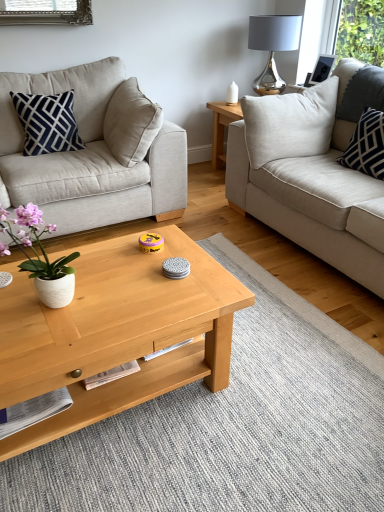
Find the location of a particular element. The height and width of the screenshot is (512, 384). light gray fabric couch at right, acting as the 1th studio couch starting from the right is located at coordinates (309, 177).

What is the approximate width of white ceramic pot at left?

It is 8.41 inches.

Describe the element at coordinates (367, 145) in the screenshot. I see `white textured pillow at right, which appears as the second pillow when viewed from the left` at that location.

Identify the location of light wood/texture coffee table at center. (116, 332).

What do you see at coordinates (116, 332) in the screenshot?
I see `light wood/texture coffee table at center` at bounding box center [116, 332].

I want to click on beige fabric couch at left, the first studio couch from the left, so click(94, 152).

Image resolution: width=384 pixels, height=512 pixels. I want to click on light gray fabric couch at right, the second studio couch in the left-to-right sequence, so click(x=309, y=177).

Is shiny metallic lamp at upper right bigger or smaller than beige fabric couch at left, which is the second studio couch from right to left?

In the image, shiny metallic lamp at upper right appears to be smaller than beige fabric couch at left, which is the second studio couch from right to left.

Which of these two, shiny metallic lamp at upper right or beige fabric couch at left, which is the second studio couch from right to left, stands shorter?

With less height is shiny metallic lamp at upper right.

Which is more to the left, shiny metallic lamp at upper right or beige fabric couch at left, the first studio couch from the left?

Positioned to the left is beige fabric couch at left, the first studio couch from the left.

Consider the image. Does light gray fabric couch at right, the second studio couch in the left-to-right sequence, appear on the right side of white textured pillow at right, which appears as the second pillow when viewed from the left?

Incorrect, light gray fabric couch at right, the second studio couch in the left-to-right sequence, is not on the right side of white textured pillow at right, which appears as the second pillow when viewed from the left.

Is light gray fabric couch at right, the second studio couch in the left-to-right sequence, located outside white textured pillow at right, positioned as the 1th pillow in right-to-left order?

Yes, light gray fabric couch at right, the second studio couch in the left-to-right sequence, is located beyond the bounds of white textured pillow at right, positioned as the 1th pillow in right-to-left order.

Is light gray fabric couch at right, acting as the 1th studio couch starting from the right, oriented away from white textured pillow at right, positioned as the 1th pillow in right-to-left order?

Yes, light gray fabric couch at right, acting as the 1th studio couch starting from the right, is facing away from white textured pillow at right, positioned as the 1th pillow in right-to-left order.

Is there a large distance between light gray fabric couch at right, acting as the 1th studio couch starting from the right, and white textured pillow at right, positioned as the 1th pillow in right-to-left order?

light gray fabric couch at right, acting as the 1th studio couch starting from the right, is near white textured pillow at right, positioned as the 1th pillow in right-to-left order, not far away.

Considering the positions of points (226, 384) and (36, 224), is point (226, 384) farther from camera compared to point (36, 224)?

Yes, it is behind point (36, 224).

Can we say light wood/texture coffee table at center lies outside white ceramic pot at left?

light wood/texture coffee table at center is positioned outside white ceramic pot at left.

Does light wood/texture coffee table at center have a lesser height compared to white ceramic pot at left?

No.

From the image's perspective, which one is positioned higher, light wood/texture coffee table at center or white ceramic pot at left?

white ceramic pot at left appears higher in the image.

The image size is (384, 512). I want to click on the 2nd pillow behind the beige fabric couch at left, which is the second studio couch from right to left, so coord(47,123).

Is point (158, 183) positioned in front of point (42, 100)?

No, (158, 183) is further to viewer.

From a real-world perspective, is beige fabric couch at left, which is the second studio couch from right to left, positioned under navy blue fabric pillow at left, which appears as the 2th pillow when viewed from the right, based on gravity?

Yes.

How many degrees apart are the facing directions of white ceramic pot at left and beige fabric couch at left, which is the second studio couch from right to left?

The angle between the facing direction of white ceramic pot at left and the facing direction of beige fabric couch at left, which is the second studio couch from right to left, is 85 degrees.

Is white ceramic pot at left oriented towards beige fabric couch at left, which is the second studio couch from right to left?

→ No, white ceramic pot at left is not aimed at beige fabric couch at left, which is the second studio couch from right to left.

Considering the sizes of white ceramic pot at left and beige fabric couch at left, which is the second studio couch from right to left, in the image, is white ceramic pot at left taller or shorter than beige fabric couch at left, which is the second studio couch from right to left,?

In the image, white ceramic pot at left appears to be shorter than beige fabric couch at left, which is the second studio couch from right to left.

Is white ceramic pot at left spatially inside beige fabric couch at left, the first studio couch from the left, or outside of it?

white ceramic pot at left is outside beige fabric couch at left, the first studio couch from the left.

In the scene shown: From a real-world perspective, is light gray fabric couch at right, acting as the 1th studio couch starting from the right, below shiny metallic lamp at upper right?

Yes, from a real-world perspective, light gray fabric couch at right, acting as the 1th studio couch starting from the right, is below shiny metallic lamp at upper right.

Is light gray fabric couch at right, acting as the 1th studio couch starting from the right, located outside shiny metallic lamp at upper right?

Indeed, light gray fabric couch at right, acting as the 1th studio couch starting from the right, is completely outside shiny metallic lamp at upper right.

From the picture: Is light gray fabric couch at right, the second studio couch in the left-to-right sequence, bigger than shiny metallic lamp at upper right?

Yes.

Identify the location of studio couch that is the 2nd object located in front of the shiny metallic lamp at upper right. This screenshot has height=512, width=384. (309, 177).

Is white ceramic pot at left oriented away from light gray fabric couch at right, acting as the 1th studio couch starting from the right?

No, white ceramic pot at left is not facing away from light gray fabric couch at right, acting as the 1th studio couch starting from the right.

Is white ceramic pot at left taller or shorter than light gray fabric couch at right, acting as the 1th studio couch starting from the right?

In the image, white ceramic pot at left appears to be shorter than light gray fabric couch at right, acting as the 1th studio couch starting from the right.

This screenshot has width=384, height=512. I want to click on houseplant located on the left of light gray fabric couch at right, acting as the 1th studio couch starting from the right, so click(39, 256).

Where is `the 1st studio couch in front of the shiny metallic lamp at upper right, starting your count from the anchor`? Image resolution: width=384 pixels, height=512 pixels. the 1st studio couch in front of the shiny metallic lamp at upper right, starting your count from the anchor is located at coordinates (94, 152).

Locate an element on the screen. Image resolution: width=384 pixels, height=512 pixels. studio couch that is the 1st object to the left of the white textured pillow at right, positioned as the 1th pillow in right-to-left order, starting at the anchor is located at coordinates (309, 177).

Based on their spatial positions, is white ceramic pot at left or white textured pillow at right, positioned as the 1th pillow in right-to-left order, closer to light gray fabric couch at right, the second studio couch in the left-to-right sequence?

white textured pillow at right, positioned as the 1th pillow in right-to-left order, is closer to light gray fabric couch at right, the second studio couch in the left-to-right sequence.

Looking at the image, which one is located closer to light wood/texture coffee table at center, white ceramic pot at left or navy blue fabric pillow at left, which appears as the 2th pillow when viewed from the right?

white ceramic pot at left is closer to light wood/texture coffee table at center.

Estimate the real-world distances between objects in this image. Which object is closer to white textured pillow at right, which appears as the second pillow when viewed from the left, light gray fabric couch at right, the second studio couch in the left-to-right sequence, or beige fabric couch at left, which is the second studio couch from right to left?

light gray fabric couch at right, the second studio couch in the left-to-right sequence, is positioned closer to the anchor white textured pillow at right, which appears as the second pillow when viewed from the left.

From the image, which object appears to be farther from light wood/texture coffee table at center, white ceramic pot at left or shiny metallic lamp at upper right?

The object further to light wood/texture coffee table at center is shiny metallic lamp at upper right.

Based on the photo, when comparing their distances from light wood/texture coffee table at center, does white textured pillow at right, which appears as the second pillow when viewed from the left, or light gray fabric couch at right, acting as the 1th studio couch starting from the right, seem closer?

light gray fabric couch at right, acting as the 1th studio couch starting from the right.

When comparing their distances from light wood/texture coffee table at center, does navy blue fabric pillow at left, marked as the 1th pillow in a left-to-right arrangement, or shiny metallic lamp at upper right seem further?

shiny metallic lamp at upper right lies further to light wood/texture coffee table at center than the other object.

When comparing their distances from white ceramic pot at left, does shiny metallic lamp at upper right or beige fabric couch at left, the first studio couch from the left, seem closer?

The object closer to white ceramic pot at left is beige fabric couch at left, the first studio couch from the left.

When comparing their distances from shiny metallic lamp at upper right, does white textured pillow at right, which appears as the second pillow when viewed from the left, or beige fabric couch at left, the first studio couch from the left, seem closer?

Based on the image, white textured pillow at right, which appears as the second pillow when viewed from the left, appears to be nearer to shiny metallic lamp at upper right.

This screenshot has height=512, width=384. I want to click on coffee table between beige fabric couch at left, the first studio couch from the left, and white textured pillow at right, positioned as the 1th pillow in right-to-left order, so click(x=116, y=332).

Where is `lamp located between beige fabric couch at left, the first studio couch from the left, and light gray fabric couch at right, acting as the 1th studio couch starting from the right, in the left-right direction`? The height and width of the screenshot is (512, 384). lamp located between beige fabric couch at left, the first studio couch from the left, and light gray fabric couch at right, acting as the 1th studio couch starting from the right, in the left-right direction is located at coordinates (273, 47).

I want to click on coffee table situated between white ceramic pot at left and light gray fabric couch at right, the second studio couch in the left-to-right sequence, from left to right, so click(x=116, y=332).

I want to click on lamp between beige fabric couch at left, which is the second studio couch from right to left, and white textured pillow at right, which appears as the second pillow when viewed from the left, from left to right, so click(273, 47).